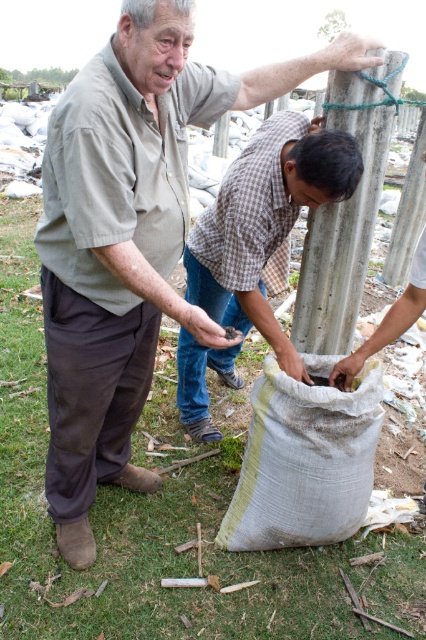
Question: Is the position of checkered fabric shirt at center more distant than that of beige canvas sack at lower center?

Choices:
 (A) yes
 (B) no

Answer: (B)

Question: From the image, what is the correct spatial relationship of matte gray shirt at center in relation to wooden post at center?

Choices:
 (A) above
 (B) below

Answer: (B)

Question: Which of the following is the farthest from the observer?

Choices:
 (A) (359, 461)
 (B) (397, 259)

Answer: (B)

Question: Which point appears closest to the camera in this image?

Choices:
 (A) (382, 72)
 (B) (239, 288)
 (C) (402, 273)
 (D) (278, 545)

Answer: (A)

Question: Among these objects, which one is farthest from the camera?

Choices:
 (A) beige canvas sack at lower center
 (B) matte gray shirt at center
 (C) wooden post at center
 (D) checkered fabric shirt at center

Answer: (C)

Question: Does beige canvas sack at lower center come in front of wooden post at center?

Choices:
 (A) no
 (B) yes

Answer: (B)